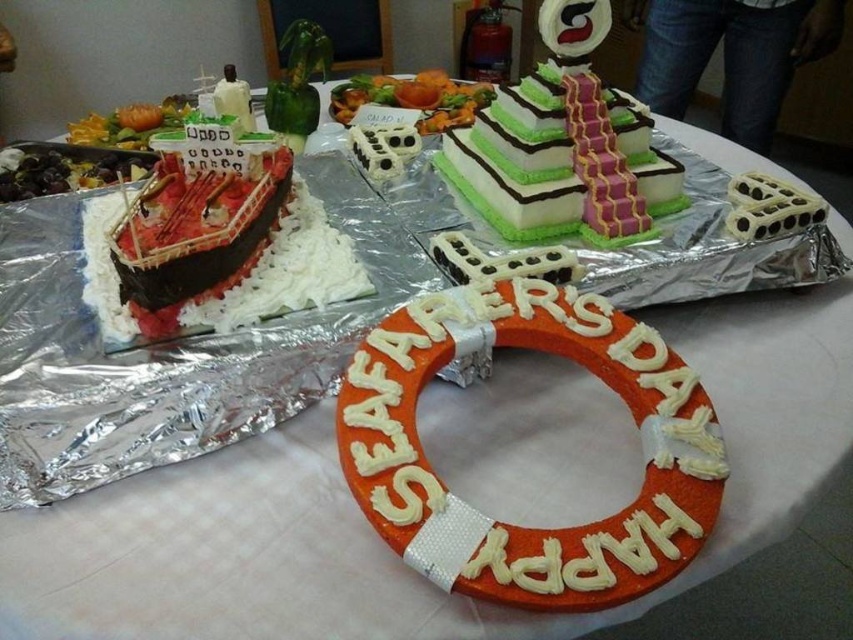
Can you confirm if chocolate fondant boat at left is positioned above green frosted cake at center?

Actually, chocolate fondant boat at left is below green frosted cake at center.

Does chocolate fondant boat at left appear on the left side of green frosted cake at center?

Indeed, chocolate fondant boat at left is positioned on the left side of green frosted cake at center.

Does point (285, 266) lie in front of point (607, 109)?

Yes.

Find the location of a particular element. chocolate fondant boat at left is located at coordinates (212, 244).

Which is more to the right, chocolate fondant boat at left or green leafy salad at center?

Positioned to the right is green leafy salad at center.

Find the location of a particular element. chocolate fondant boat at left is located at coordinates (212, 244).

Does orange fondant life belt at center appear over green leafy salad at center?

No.

Locate an element on the screen. The height and width of the screenshot is (640, 853). orange fondant life belt at center is located at coordinates (515, 525).